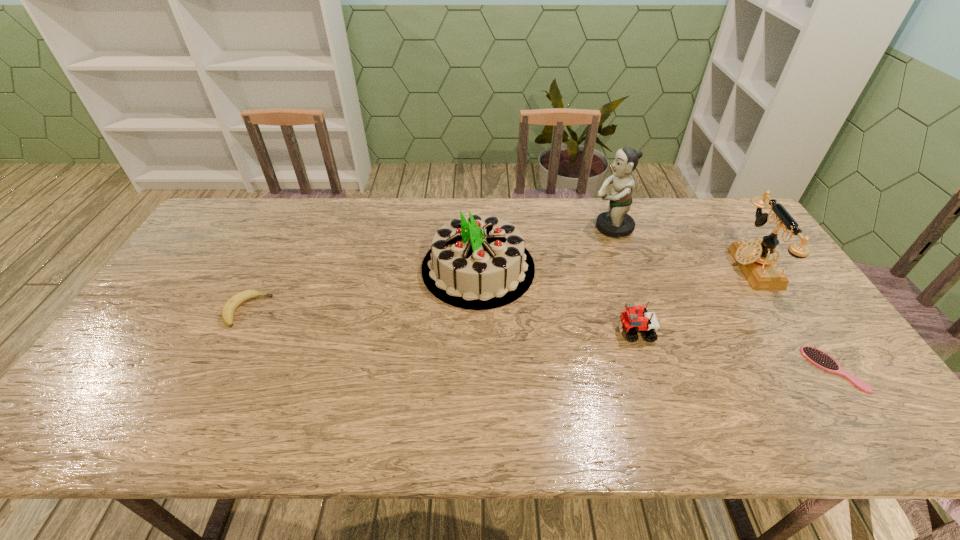
You are a GUI agent. You are given a task and a screenshot of the screen. Output one action in this format:
    pyautogui.click(x=<x>, y=<y>)
    Task: Click on the free space that satisfies the following two spatial constraints: 1. on the back side of the hairbrush; 2. on the dial of the telephone
    
    Given the screenshot: What is the action you would take?
    pyautogui.click(x=764, y=267)

Where is `vacant area in the image that satisfies the following two spatial constraints: 1. on the dial of the telephone; 2. on the left side of the shortest object`? vacant area in the image that satisfies the following two spatial constraints: 1. on the dial of the telephone; 2. on the left side of the shortest object is located at coordinates click(818, 369).